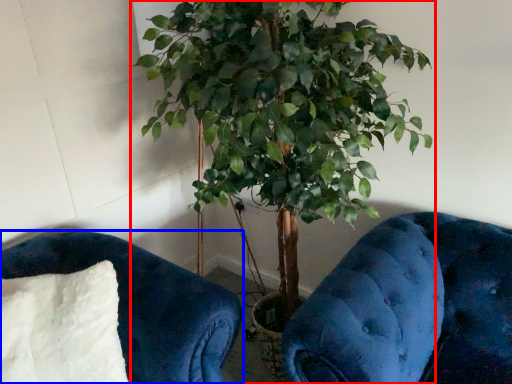
Question: Which object is closer to the camera taking this photo, houseplant (highlighted by a red box) or furniture (highlighted by a blue box)?

Choices:
 (A) houseplant
 (B) furniture

Answer: (A)